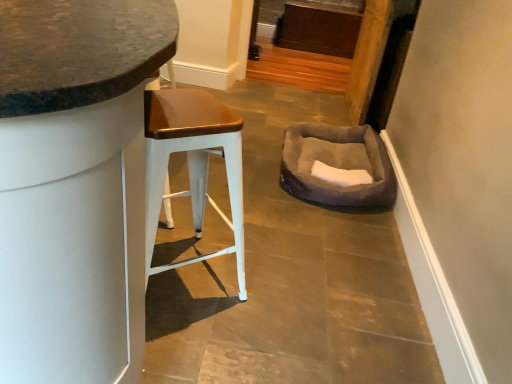
Question: From a real-world perspective, is white metal stool at left under suede-like gray bean bag at center-right?

Choices:
 (A) no
 (B) yes

Answer: (A)

Question: Does white metal stool at left have a lesser width compared to suede-like gray bean bag at center-right?

Choices:
 (A) no
 (B) yes

Answer: (B)

Question: Does white metal stool at left have a greater width compared to suede-like gray bean bag at center-right?

Choices:
 (A) yes
 (B) no

Answer: (B)

Question: Is white metal stool at left oriented towards suede-like gray bean bag at center-right?

Choices:
 (A) yes
 (B) no

Answer: (B)

Question: Is white metal stool at left outside of suede-like gray bean bag at center-right?

Choices:
 (A) no
 (B) yes

Answer: (B)

Question: Is white metal stool at left oriented away from suede-like gray bean bag at center-right?

Choices:
 (A) yes
 (B) no

Answer: (B)

Question: Is suede-like gray bean bag at center-right positioned with its back to matte white stool at left?

Choices:
 (A) yes
 (B) no

Answer: (B)

Question: Can you confirm if suede-like gray bean bag at center-right is positioned to the right of matte white stool at left?

Choices:
 (A) no
 (B) yes

Answer: (B)

Question: Does suede-like gray bean bag at center-right appear on the left side of matte white stool at left?

Choices:
 (A) no
 (B) yes

Answer: (A)

Question: Can you confirm if suede-like gray bean bag at center-right is bigger than matte white stool at left?

Choices:
 (A) yes
 (B) no

Answer: (B)

Question: Is suede-like gray bean bag at center-right thinner than matte white stool at left?

Choices:
 (A) no
 (B) yes

Answer: (B)

Question: From a real-world perspective, is suede-like gray bean bag at center-right physically above matte white stool at left?

Choices:
 (A) no
 (B) yes

Answer: (A)

Question: Is white metal stool at left wider than matte white stool at left?

Choices:
 (A) yes
 (B) no

Answer: (B)